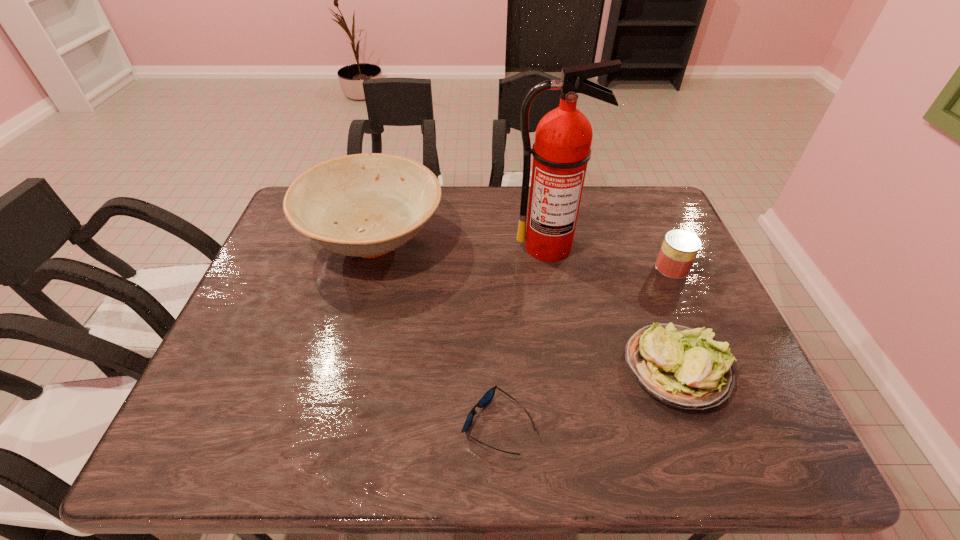
Locate an element on the screen. This screenshot has height=540, width=960. fire extinguisher is located at coordinates (562, 148).

At what (x,y) coordinates should I click in order to perform the action: click on the leftmost object. Please return your answer as a coordinate pair (x, y). The image size is (960, 540). Looking at the image, I should click on (365, 205).

The width and height of the screenshot is (960, 540). What are the coordinates of `dish` in the screenshot? It's located at (365, 205).

The width and height of the screenshot is (960, 540). Find the location of `can`. can is located at coordinates (679, 249).

Where is `the second shortest object`? This screenshot has width=960, height=540. the second shortest object is located at coordinates (681, 366).

You are a GUI agent. You are given a task and a screenshot of the screen. Output one action in this format:
    pyautogui.click(x=<x>, y=<y>)
    Task: Click on the shortest object
    
    Given the screenshot: What is the action you would take?
    pyautogui.click(x=488, y=396)

Find the location of a particular element. vacant space located on the side of the fire extinguisher near the handle is located at coordinates (557, 292).

You are a GUI agent. You are given a task and a screenshot of the screen. Output one action in this format:
    pyautogui.click(x=<x>, y=<y>)
    Task: Click on the free space located 0.080m on the front of the second tallest object
    
    Given the screenshot: What is the action you would take?
    pyautogui.click(x=355, y=314)

Identify the location of free spot located 0.250m on the front of the can. The width and height of the screenshot is (960, 540). pyautogui.click(x=710, y=354).

Where is `vacant area situated 0.390m on the left of the lettuce`? Image resolution: width=960 pixels, height=540 pixels. vacant area situated 0.390m on the left of the lettuce is located at coordinates (454, 368).